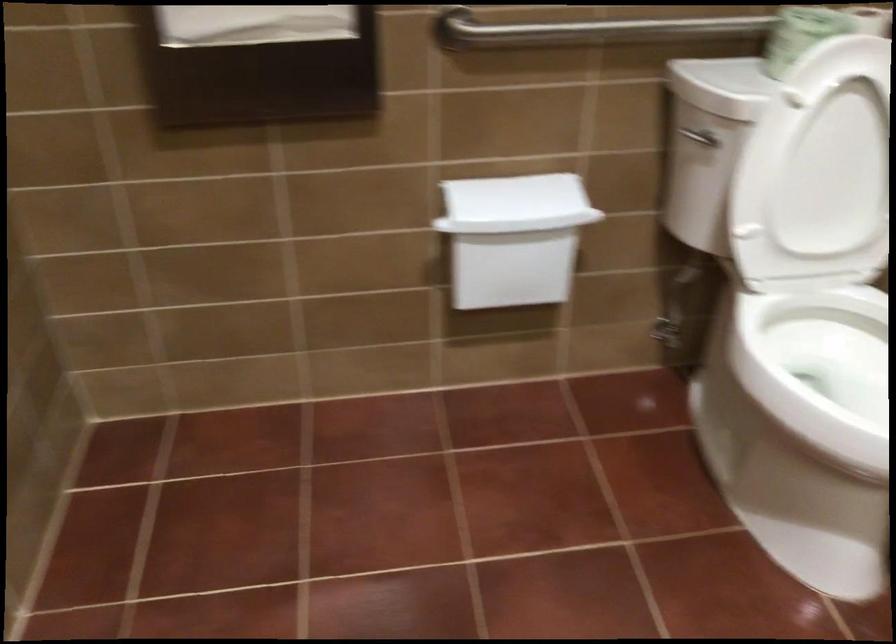
The width and height of the screenshot is (896, 644). I want to click on paper towel dispenser, so click(513, 196).